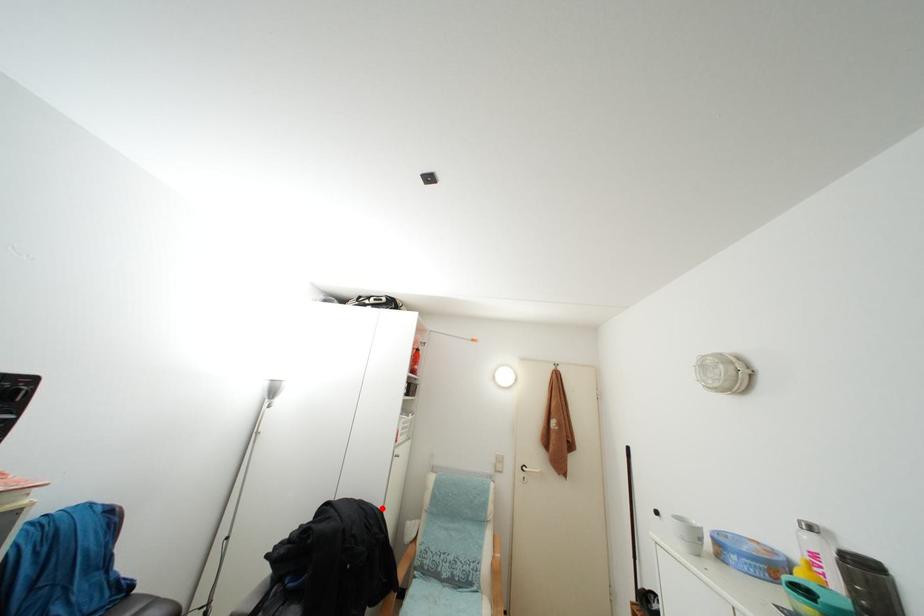
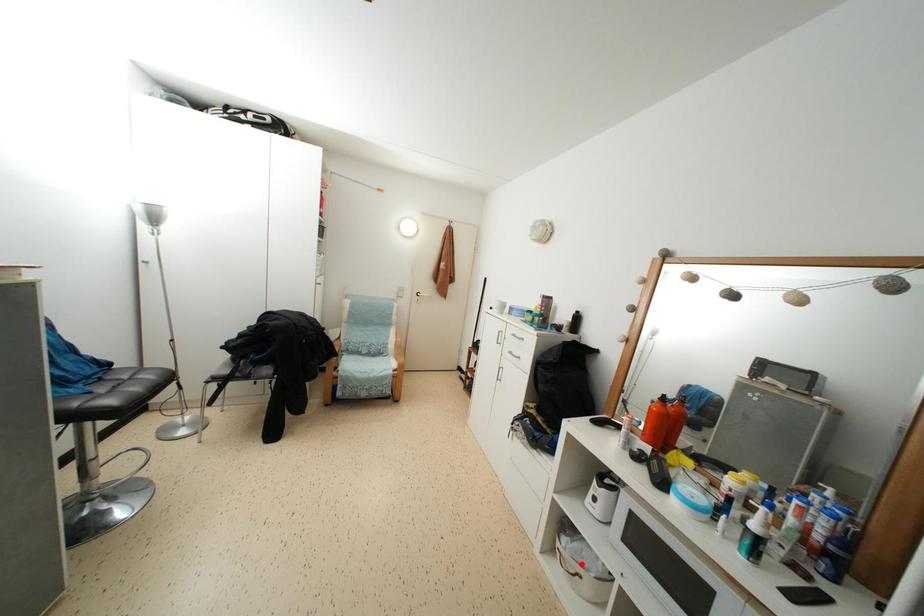
I am providing you with two images of the same scene from different viewpoints. A red point is marked on the first image and another point is marked on the second image. Are the points marked in image1 and image2 representing the same 3D position?

No